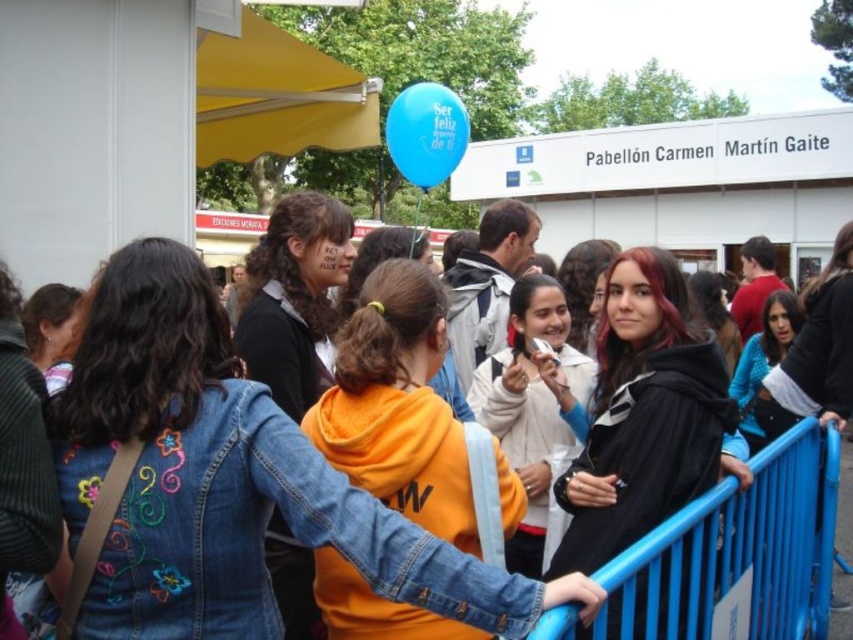
Question: Which point appears closest to the camera in this image?

Choices:
 (A) (506, 400)
 (B) (624, 566)

Answer: (B)

Question: Which point is closer to the camera?

Choices:
 (A) orange fleece at center
 (B) black matte jacket at center

Answer: (A)

Question: Is the position of denim jacket at center more distant than that of yellow fabric canopy at upper left?

Choices:
 (A) yes
 (B) no

Answer: (B)

Question: Is the position of blue rubber balloon at upper center more distant than that of blue denim jacket at lower right?

Choices:
 (A) yes
 (B) no

Answer: (A)

Question: Does white fleece jacket at center have a lesser width compared to blue denim jacket at lower right?

Choices:
 (A) yes
 (B) no

Answer: (A)

Question: Which point is closer to the camera?

Choices:
 (A) blue denim jacket at lower right
 (B) black matte jacket at center
 (C) orange fleece at center
 (D) yellow fabric canopy at upper left

Answer: (C)